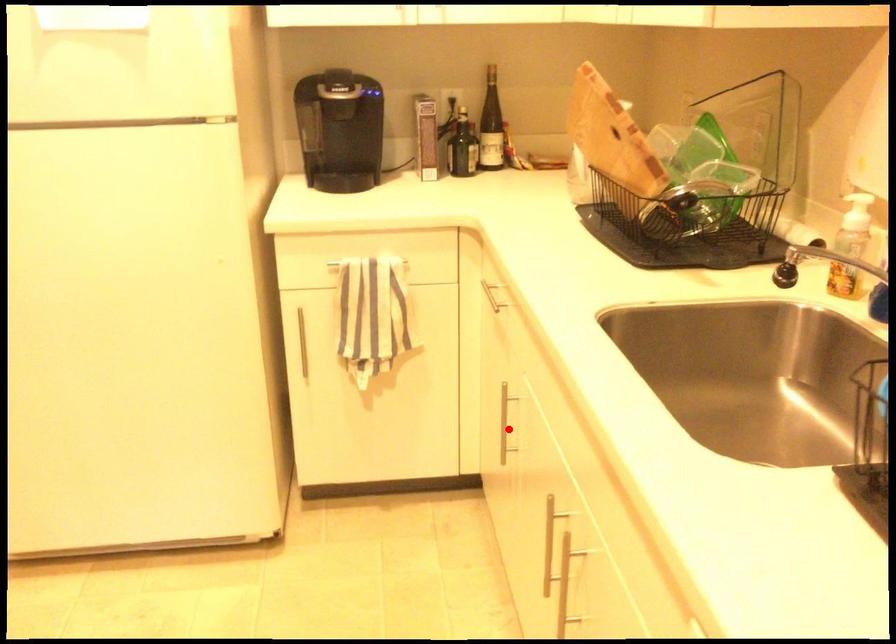
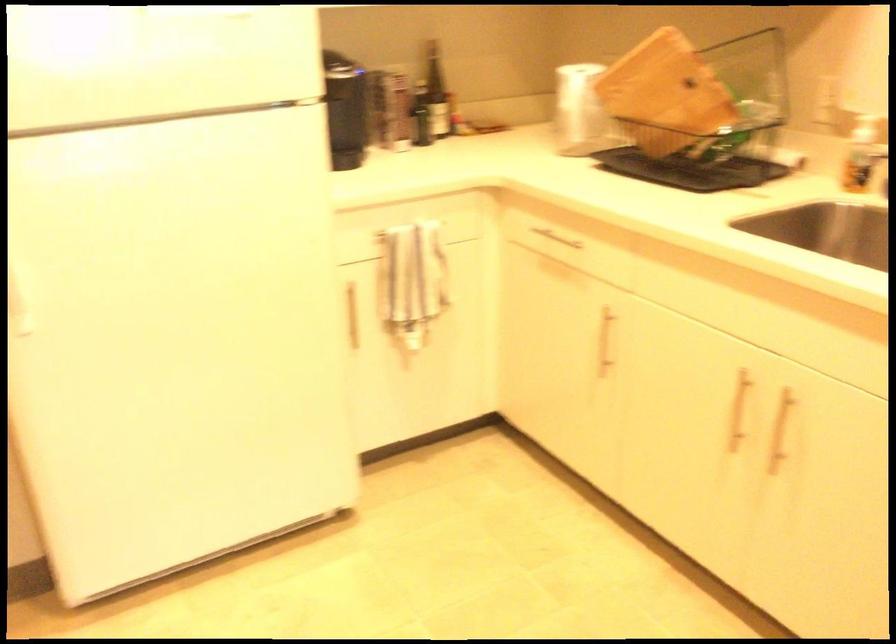
The point at the highlighted location is marked in the first image. Where is the corresponding point in the second image?

(605, 341)